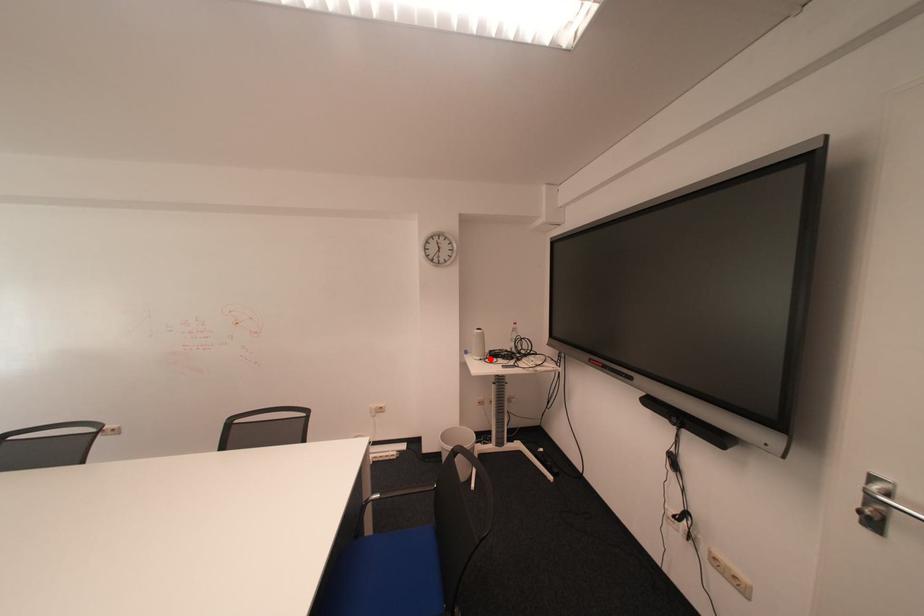
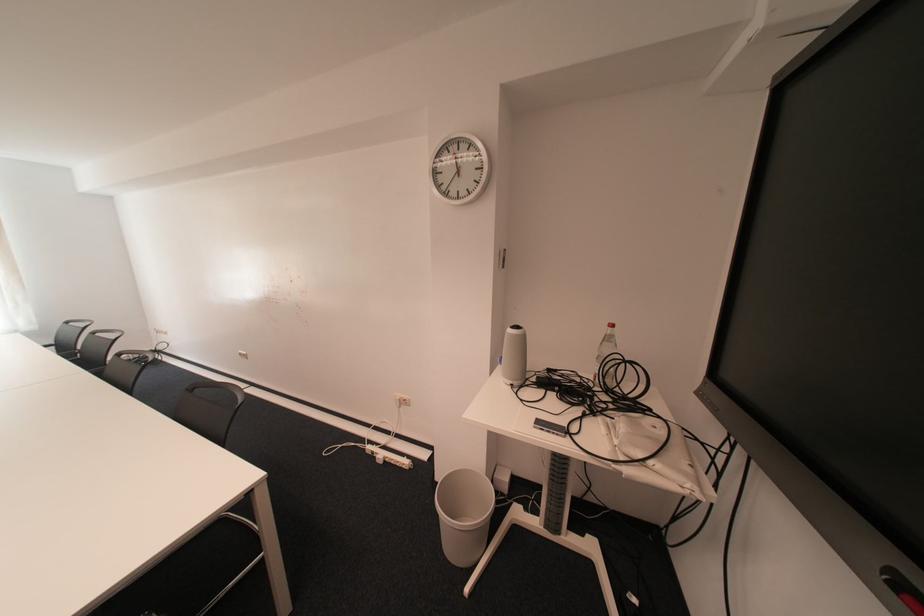
Where in the second image is the point corresponding to the highlighted location from the first image?

(520, 383)